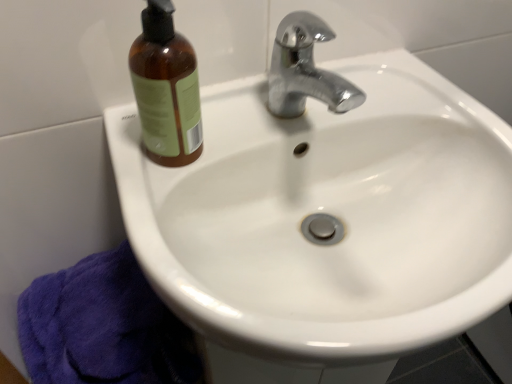
Identify the location of vacant area located to the right-hand side of brown glass bottle at upper left. (265, 132).